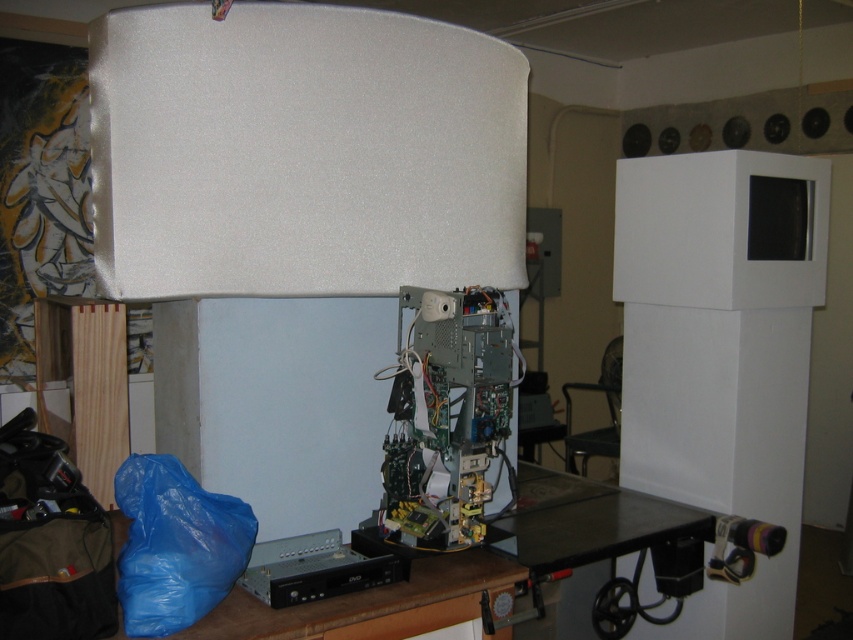
You are working on repairing an electronic device and have both the green circuit board at center and the metallic gray dvd player at lower center in front of you. Which object takes up more space in terms of physical size?

The green circuit board at center is bigger than the metallic gray dvd player at lower center, so it takes up more space in terms of physical size.

You are an engineer working on the disassembled electronic device at the center of the workspace. You need to locate the green circuit board at center. Where exactly is it positioned in the workspace?

The green circuit board at center is positioned at point coordinates of 0.647 on the x axis and 0.524 on the y axis.

You are working on repairing an electronic device in the workshop. You need to access both the green circuit board at center and the metallic gray dvd player at lower center. Which one is located to the right of the other?

The green circuit board at center is positioned on the right side of the metallic gray dvd player at lower center.